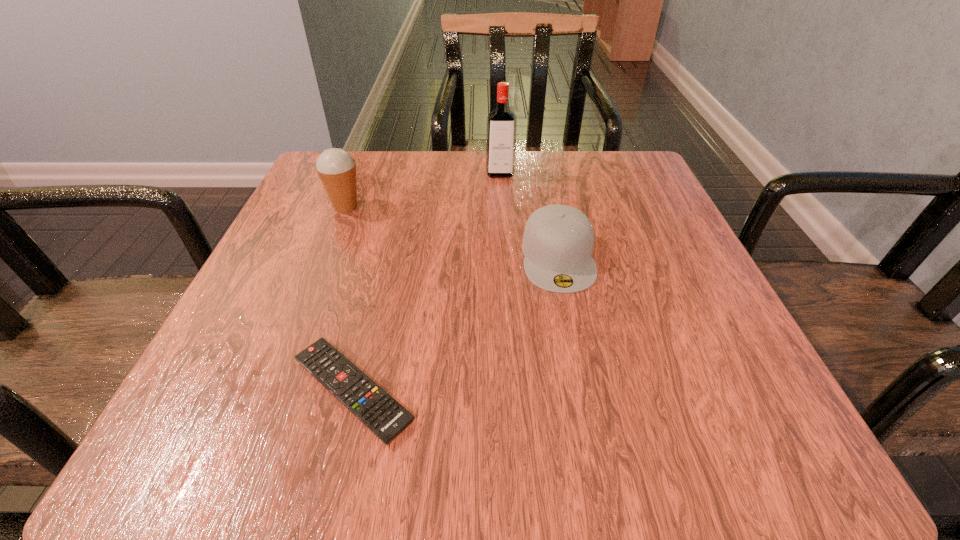
Where is `free spot located 0.180m on the front-facing side of the cap`? Image resolution: width=960 pixels, height=540 pixels. free spot located 0.180m on the front-facing side of the cap is located at coordinates (586, 394).

Image resolution: width=960 pixels, height=540 pixels. I want to click on vacant space located on the right of the nearest object, so click(x=732, y=390).

Identify the location of vodka at the far edge. The height and width of the screenshot is (540, 960). (501, 130).

Locate an element on the screen. Image resolution: width=960 pixels, height=540 pixels. icecream that is positioned at the far edge is located at coordinates (336, 168).

Where is `object that is at the near edge`? object that is at the near edge is located at coordinates (382, 414).

Locate an element on the screen. icecream at the left edge is located at coordinates click(x=336, y=168).

I want to click on remote control at the left edge, so click(x=382, y=414).

Identify the location of object located at the far left corner. (336, 168).

Locate an element on the screen. object situated at the near left corner is located at coordinates (382, 414).

Image resolution: width=960 pixels, height=540 pixels. In the image, there is a desktop. Find the location of `vacant space at the far edge`. vacant space at the far edge is located at coordinates (424, 160).